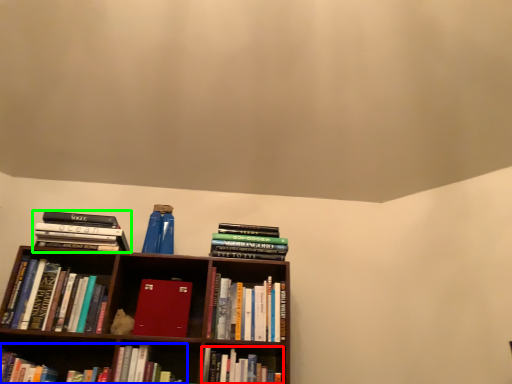
Question: Considering the real-world distances, which object is closest to book (highlighted by a red box)? book (highlighted by a blue box) or book (highlighted by a green box).

Choices:
 (A) book
 (B) book

Answer: (A)